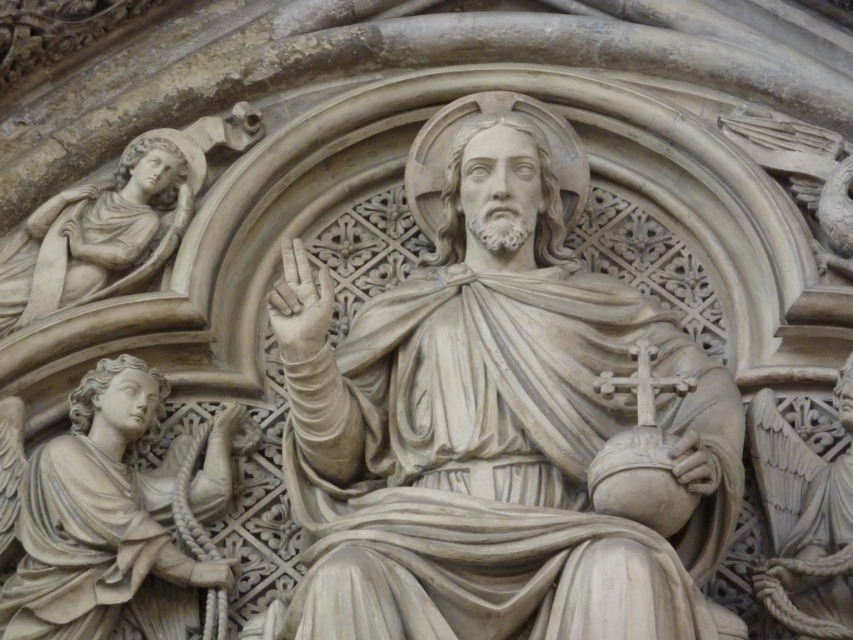
You are an art conservator examining the stone relief sculpture. You need to determine which object is bigger between the white marble statue at center and the white stone angel at right. Which one is larger?

The white marble statue at center is larger in size than the white stone angel at right.

You are an art conservator examining the stone relief sculpture. You notice two angels, the white marble angel at upper left and the white stone angel at right. Which angel appears smaller in height?

The white marble angel at upper left appears smaller in height compared to the white stone angel at right because it is not as tall as the latter according to the description.

You are an art conservator standing 100 meters away from the stone relief sculpture. You need to inspect the white marble angel at upper left. Is the angel within your reach without moving closer?

The white marble angel at upper left is 85.55 meters away from the viewer. Since you are standing 100 meters away, the angel is beyond your reach without moving closer.